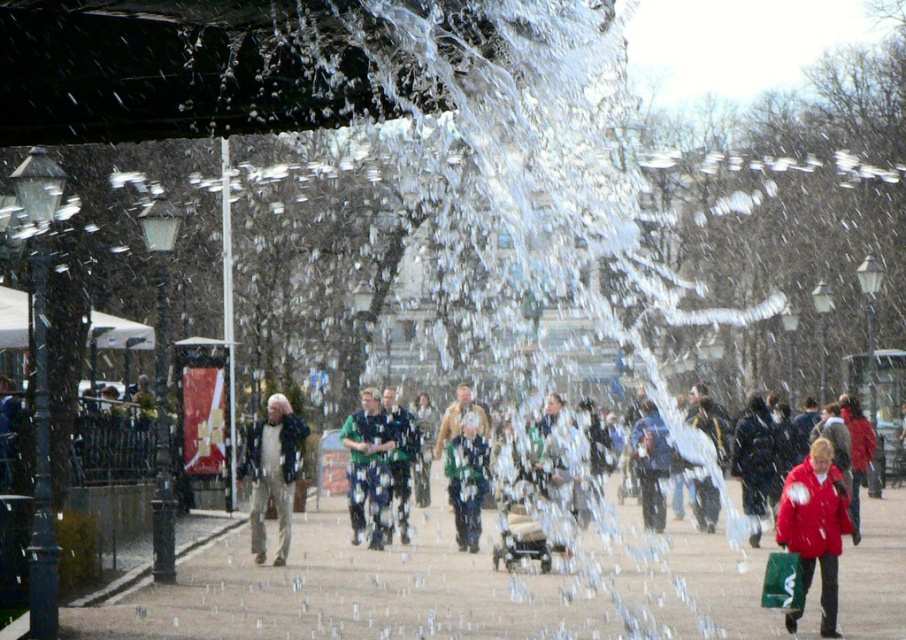
Which of these two, clear water at center or green fabric jacket at center, stands taller?

clear water at center

Between point (605, 147) and point (401, 445), which one is positioned in front?

Point (401, 445) is in front.

Describe the element at coordinates (535, 202) in the screenshot. The image size is (906, 640). I see `clear water at center` at that location.

You are a GUI agent. You are given a task and a screenshot of the screen. Output one action in this format:
    pyautogui.click(x=<x>, y=<y>)
    Task: Click on the clear water at center
    The width and height of the screenshot is (906, 640).
    Given the screenshot: What is the action you would take?
    pyautogui.click(x=535, y=202)

Is clear water at center wider than green knitted sweater at center?

Yes.

Is point (482, 125) positioned after point (371, 545)?

No, (482, 125) is in front of (371, 545).

Does point (666, 388) lie in front of point (374, 460)?

No, (666, 388) is further to viewer.

Find the location of a particular element. This screenshot has width=906, height=640. clear water at center is located at coordinates (535, 202).

Can you confirm if clear water at center is bigger than green textured scarf at center?

Indeed, clear water at center has a larger size compared to green textured scarf at center.

What do you see at coordinates (535, 202) in the screenshot?
I see `clear water at center` at bounding box center [535, 202].

Between point (483, 362) and point (477, 522), which one is positioned in front?

Point (477, 522) is in front.

Identify the location of clear water at center. This screenshot has height=640, width=906. (535, 202).